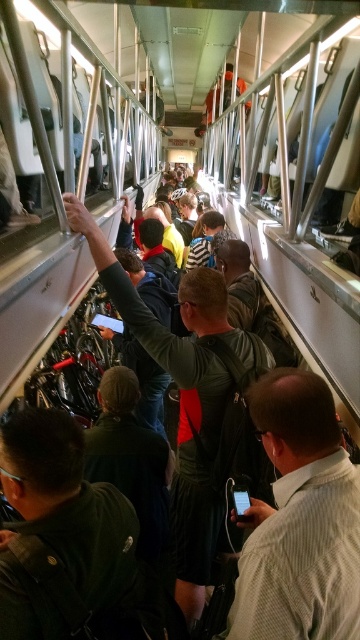
In the scene shown: You are a passenger in the crowded train carriage. You want to move forward to the exit door located at the front of the carriage. There is a light brown shirt at center and a dark green jacket at center blocking your path. Which person should you ask to move aside first?

The dark green jacket at center is behind light brown shirt at center, so you should ask the person wearing the light brown shirt at center to move aside first since they are closer to your current position.

You are a passenger on a crowded train and want to reach the exit door located at the far end of the carriage. You notice two people blocking your path at the center of the carriage. They are a person wearing a light brown shirt at center and a person in a dark gray leather jacket at center. Which person should you ask to move aside first to create a path towards the exit?

You should ask the light brown shirt at center to move aside first because they are in front of the dark gray leather jacket at center, making them closer to your current position. Once they step aside, you can then proceed past the dark gray leather jacket at center.

You are a passenger on a crowded train and need to move past two people in the center of the carriage. The light brown shirt at center and the dark green jacket at center are standing close to each other. Which person might you have more difficulty moving around due to their size?

The light brown shirt at center has a larger width than the dark green jacket at center, so you might have more difficulty moving around the light brown shirt at center due to its greater size.